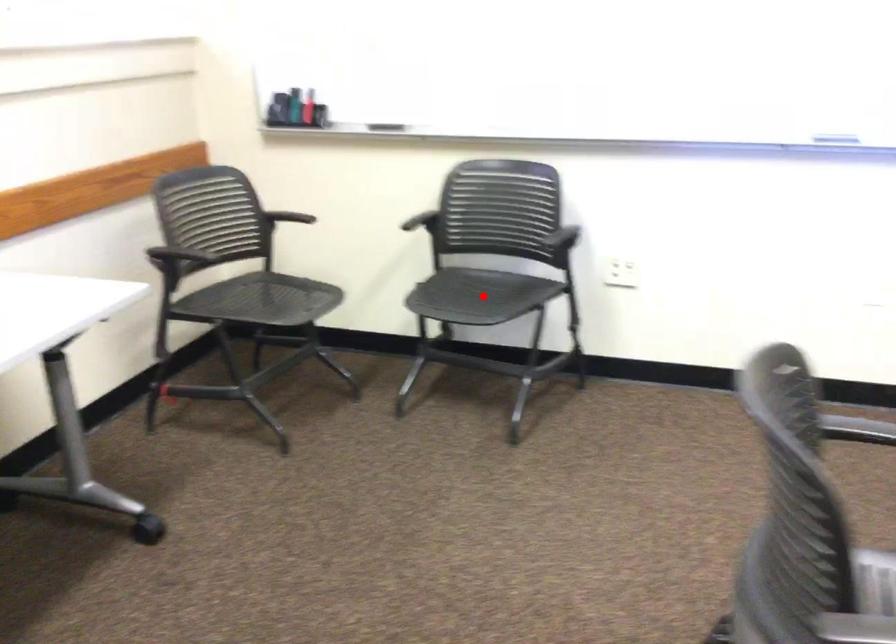
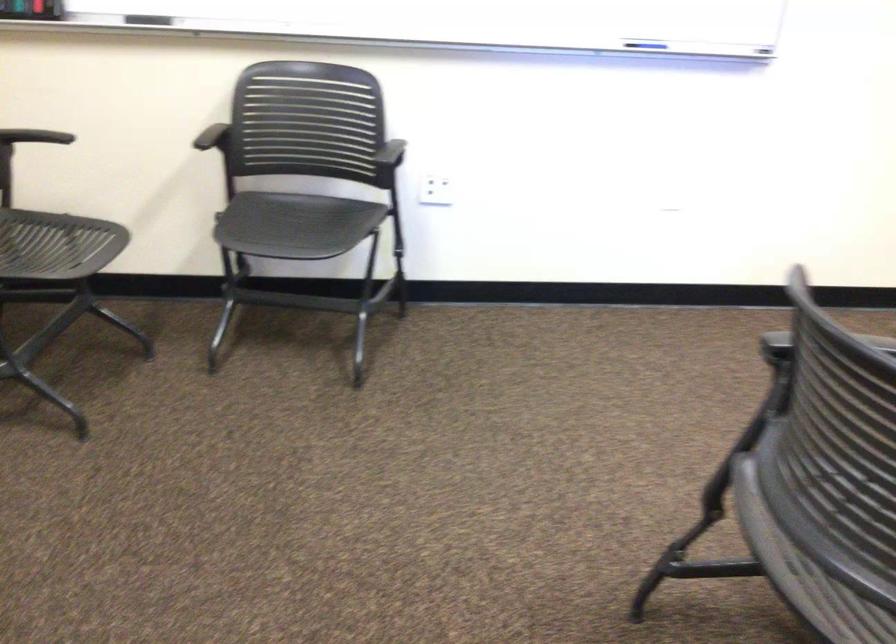
In the second image, find the point that corresponds to the highlighted location in the first image.

(295, 225)